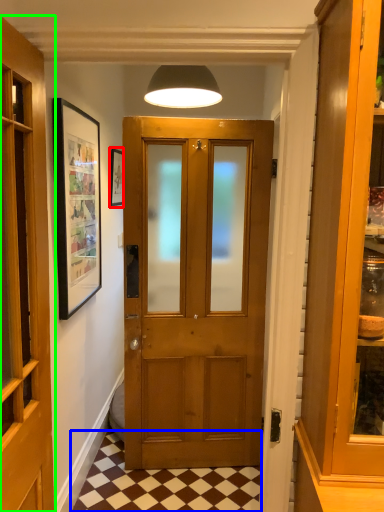
Question: Considering the real-world distances, which object is farthest from picture frame (highlighted by a red box)? tile (highlighted by a blue box) or door (highlighted by a green box)?

Choices:
 (A) tile
 (B) door

Answer: (A)